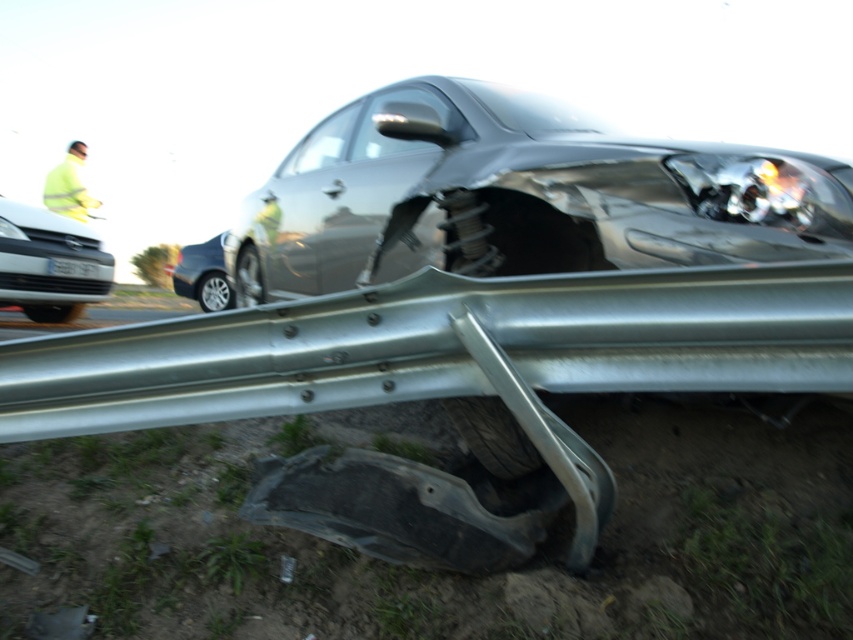
Question: Which object is the farthest from the satin silver car at center?

Choices:
 (A) shiny metallic sedan at center
 (B) white glossy sedan at upper left
 (C) high visibility yellow jacket at upper left

Answer: (C)

Question: Among these objects, which one is farthest from the camera?

Choices:
 (A) shiny metallic sedan at center
 (B) satin silver car at center
 (C) high visibility yellow jacket at upper left
 (D) white glossy sedan at upper left

Answer: (A)

Question: Does satin silver car at center appear on the right side of white glossy sedan at upper left?

Choices:
 (A) yes
 (B) no

Answer: (A)

Question: Is satin silver car at center to the left of white glossy sedan at upper left from the viewer's perspective?

Choices:
 (A) yes
 (B) no

Answer: (B)

Question: Among these points, which one is farthest from the camera?

Choices:
 (A) (212, 266)
 (B) (13, 211)

Answer: (A)

Question: Considering the relative positions of white glossy sedan at upper left and high visibility yellow jacket at upper left in the image provided, where is white glossy sedan at upper left located with respect to high visibility yellow jacket at upper left?

Choices:
 (A) left
 (B) right

Answer: (B)